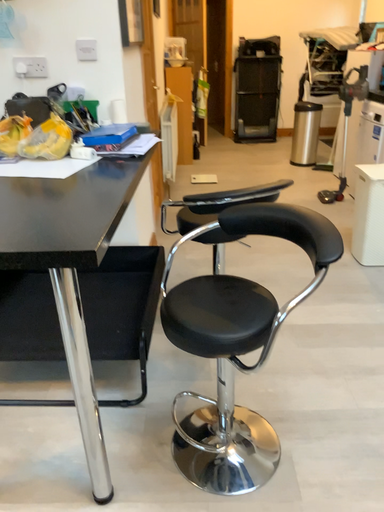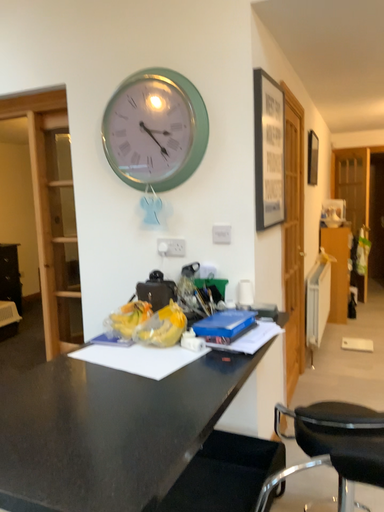
Question: Which way did the camera rotate in the video?

Choices:
 (A) rotated upward
 (B) rotated downward

Answer: (A)